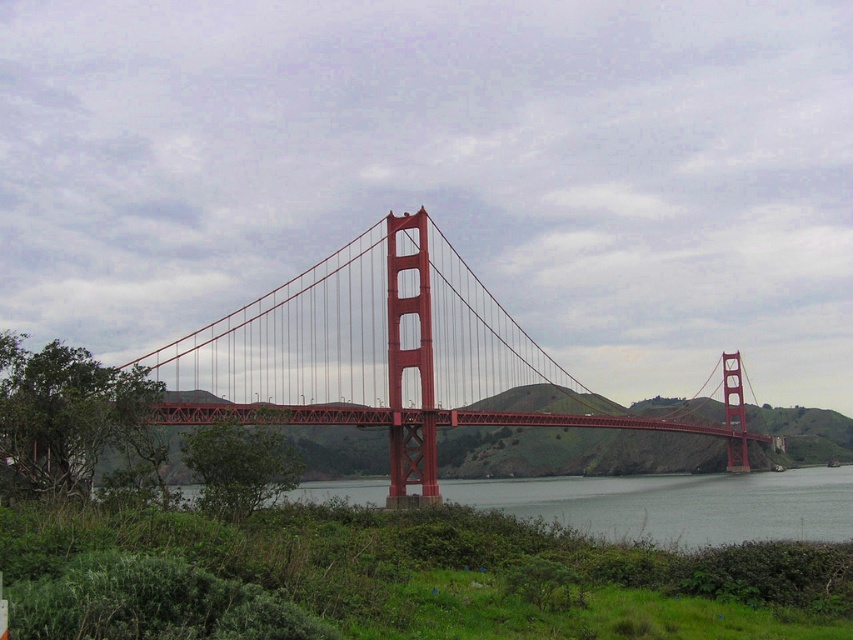
Is metallic red suspension bridge at center in front of clear water at center?

No, metallic red suspension bridge at center is further to the viewer.

The image size is (853, 640). What do you see at coordinates (397, 358) in the screenshot? I see `metallic red suspension bridge at center` at bounding box center [397, 358].

At what (x,y) coordinates should I click in order to perform the action: click on metallic red suspension bridge at center. Please return your answer as a coordinate pair (x, y). The width and height of the screenshot is (853, 640). Looking at the image, I should click on (397, 358).